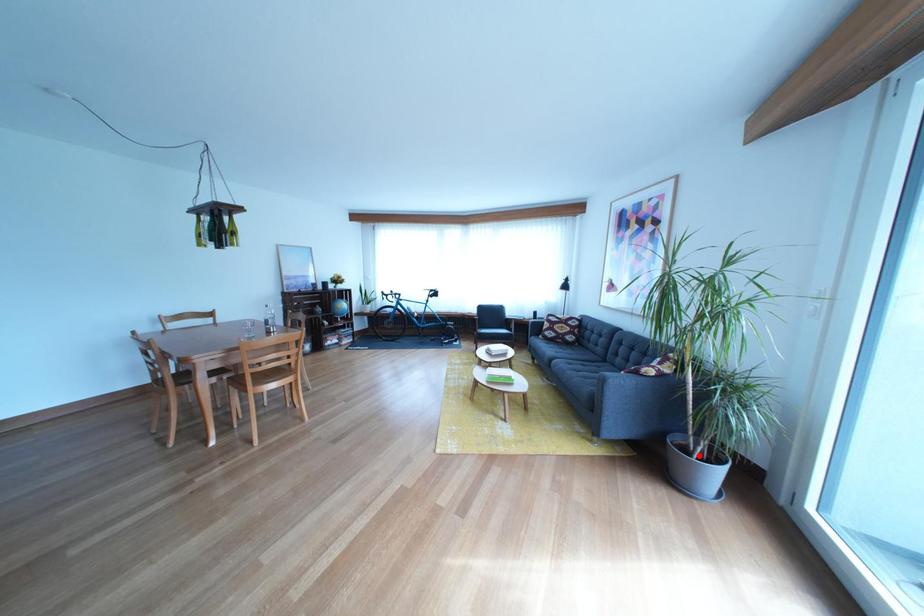
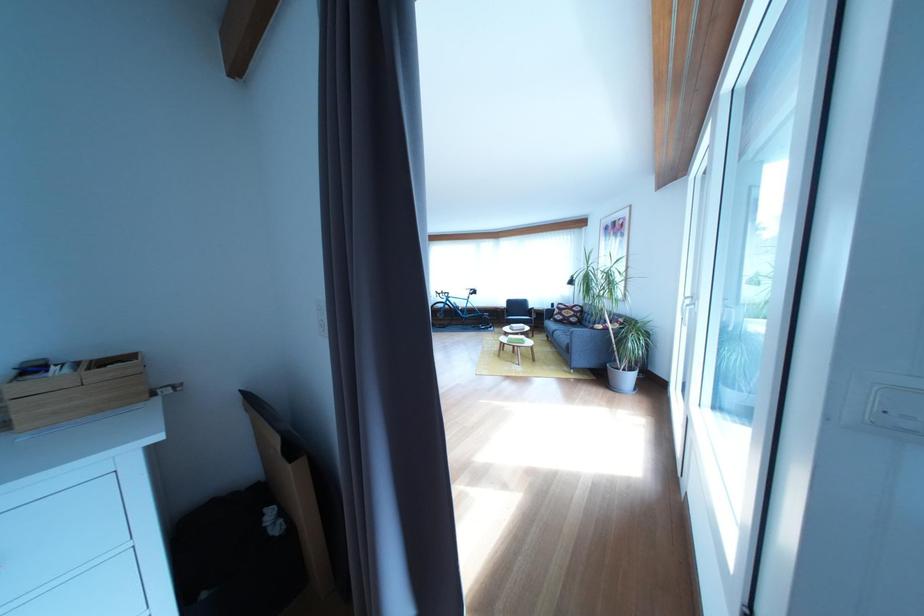
Question: I am providing you with two images of the same scene from different viewpoints. Given a red point in image1, look at the same physical point in image2. Is it:

Choices:
 (A) Closer to the viewpoint
 (B) Farther from the viewpoint

Answer: (A)